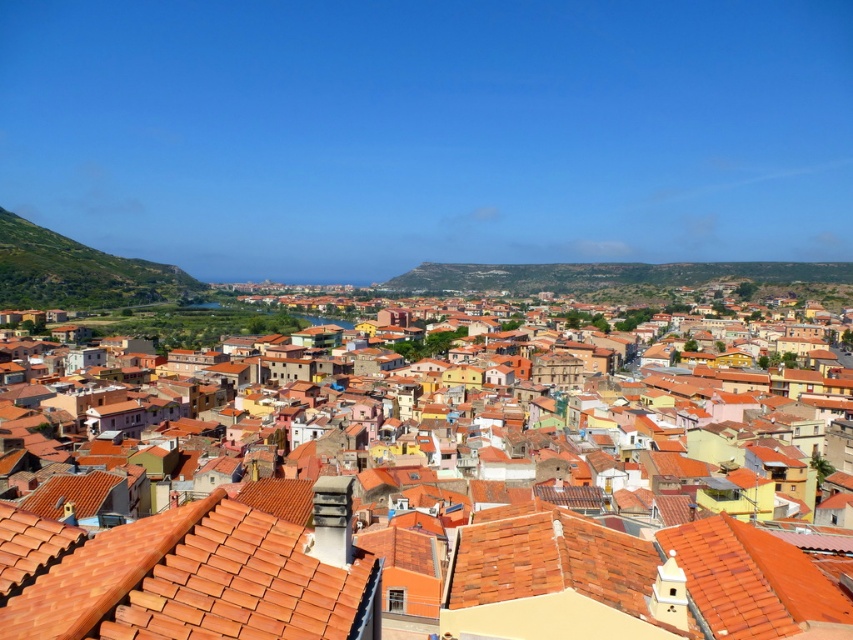
Who is higher up, terracotta tiles at center or terracotta tiles at lower left?

terracotta tiles at lower left is above.

Can you confirm if terracotta tiles at center is positioned above terracotta tiles at lower left?

No.

Where is `terracotta tiles at center`? Image resolution: width=853 pixels, height=640 pixels. terracotta tiles at center is located at coordinates (631, 580).